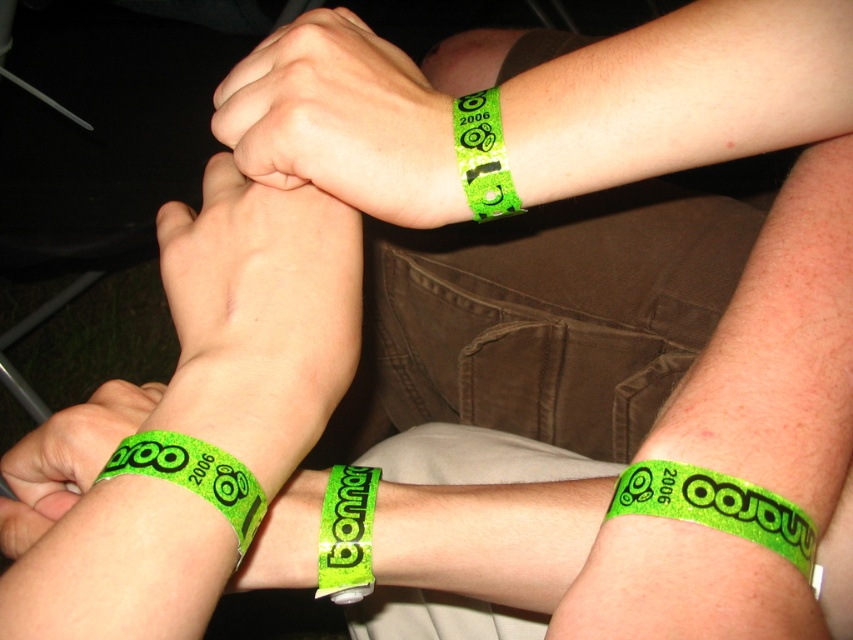
You are a photographer reviewing the image of the wrists. You need to determine the position of the green glitter wristband at lower left relative to the other objects in the scene. Based on the coordinates provided, can you confirm if it is positioned at the lower left corner of the image?

The green glitter wristband at lower left is located at point coordinates (x=67, y=458), which places it at the lower left corner of the image.

You are standing in front of the image and want to know which point is closer to you. The points are point (422, 108) and point (460, 161). Which one is closer?

Point (422, 108) is closer to you than point (460, 161).